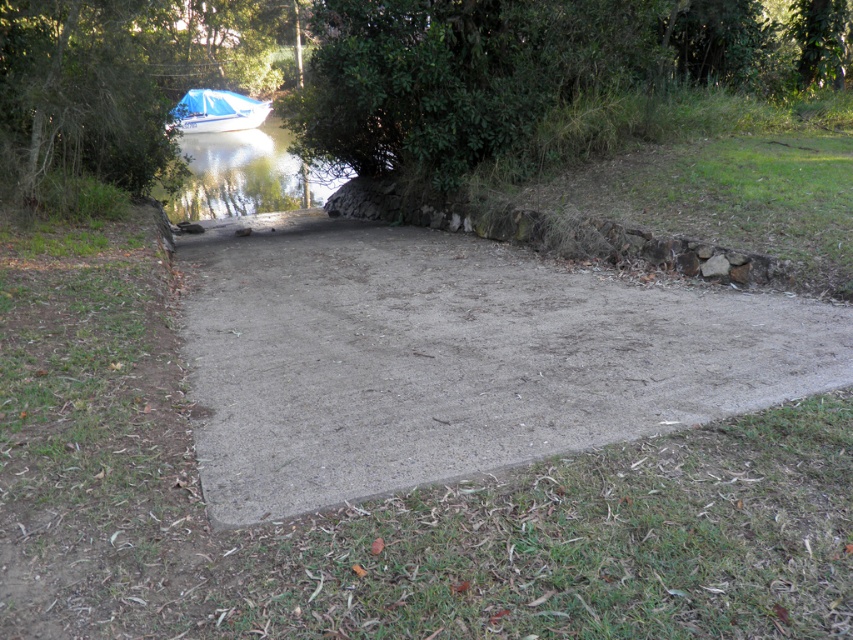
You are a photographer trying to capture the blue glossy water at upper left and the blue tarpaulin boat at upper left in a single shot. Which object will occupy more space in your photo?

The blue glossy water at upper left is larger in size than the blue tarpaulin boat at upper left, so it will occupy more space in the photo.

You are planning to take a photo of the dull concrete path at center and the blue glossy water at upper left. Which object will occupy a smaller portion of the photo?

The dull concrete path at center occupies less space than blue glossy water at upper left, so the dull concrete path at center will occupy a smaller portion of the photo.